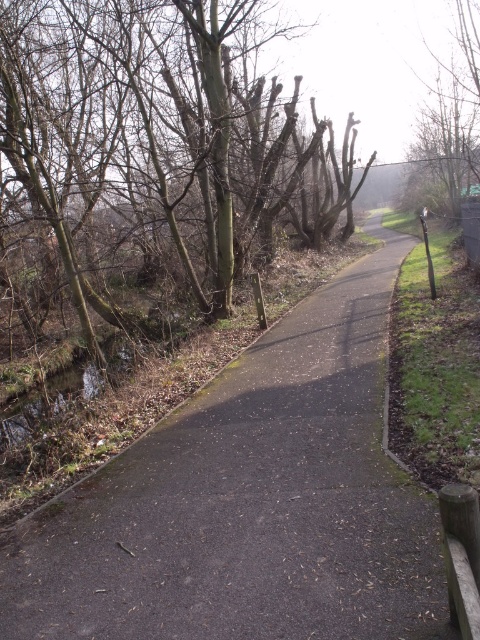
Question: Can you confirm if dark asphalt path at center is positioned below smooth bark tree at upper center?

Choices:
 (A) no
 (B) yes

Answer: (B)

Question: Does dark asphalt path at center come in front of bare wood tree at upper right?

Choices:
 (A) no
 (B) yes

Answer: (B)

Question: Does dark asphalt path at center have a lesser width compared to bare wood tree at upper right?

Choices:
 (A) yes
 (B) no

Answer: (A)

Question: Among these objects, which one is nearest to the camera?

Choices:
 (A) bare wood tree at upper right
 (B) dark asphalt path at center

Answer: (B)

Question: Which object is the farthest from the dark asphalt path at center?

Choices:
 (A) bare wood tree at upper right
 (B) smooth bark tree at upper center

Answer: (A)

Question: Which of the following is the closest to the observer?

Choices:
 (A) smooth bark tree at upper center
 (B) dark asphalt path at center

Answer: (B)